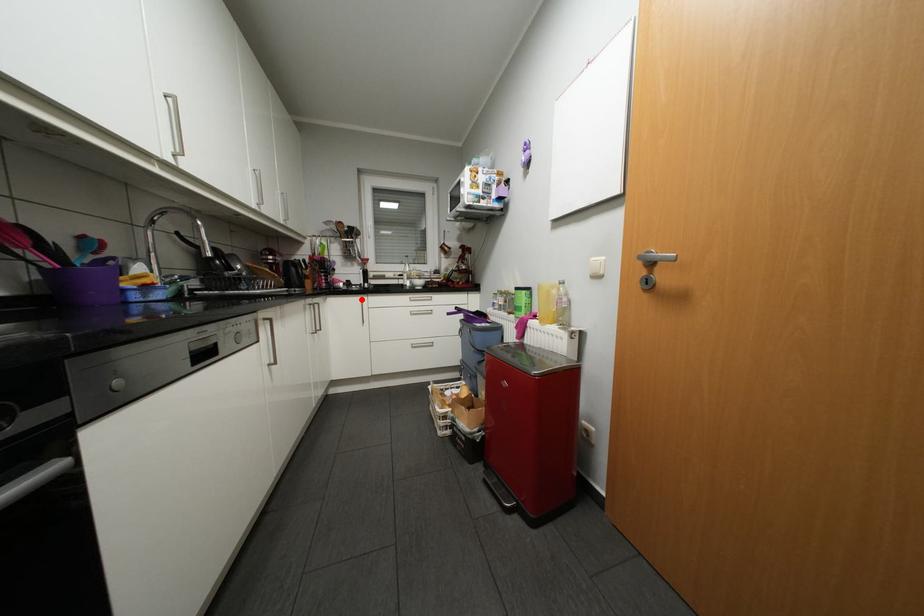
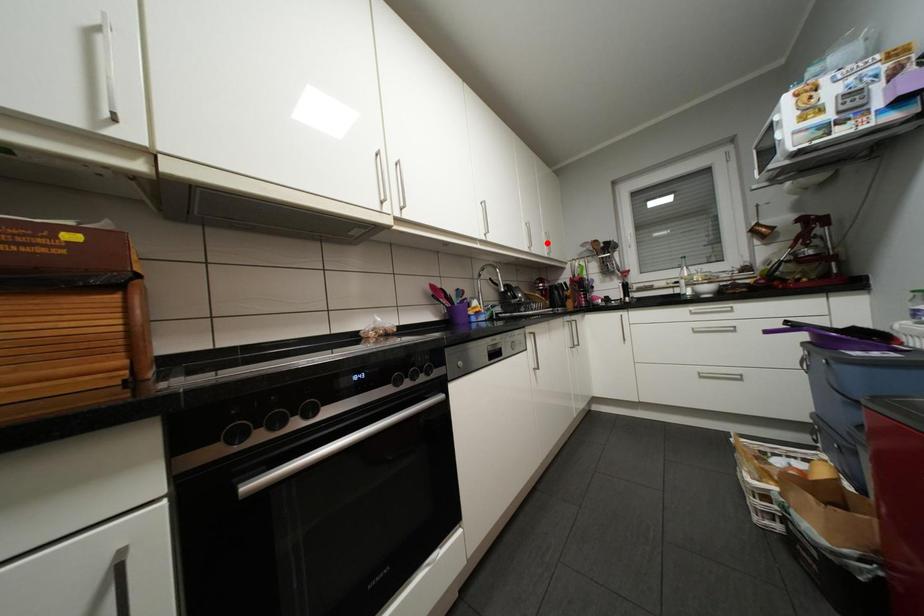
I am providing you with two images of the same scene from different viewpoints. A red point is marked on the first image and another point is marked on the second image. Does the point marked in image1 correspond to the same location as the one in image2?

No